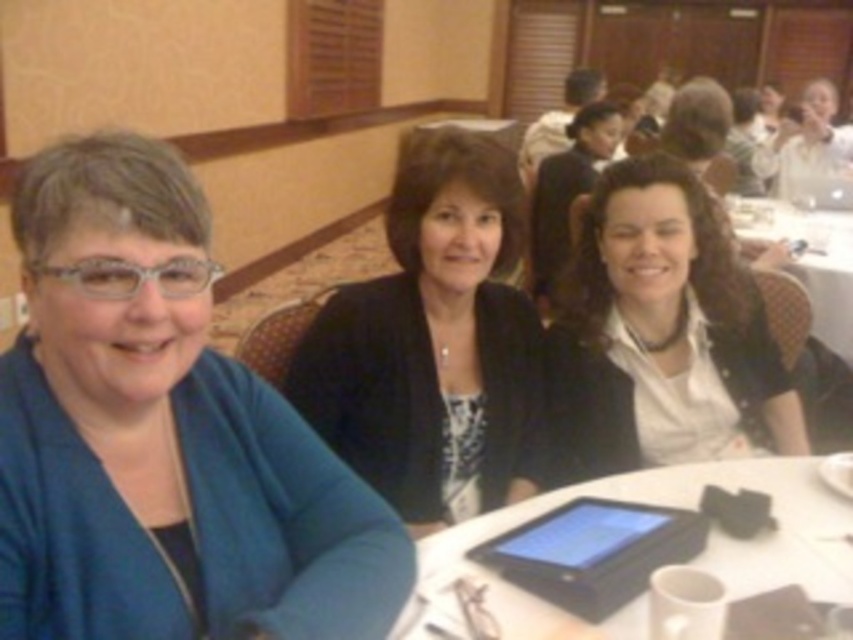
Is white matte shirt at center further to the viewer compared to white glossy table at lower center?

Yes, it is behind white glossy table at lower center.

Is point (593, 241) closer to viewer compared to point (440, 600)?

No, it is behind (440, 600).

What are the coordinates of `white matte shirt at center` in the screenshot? It's located at (654, 323).

Consider the image. Does black matte tablet at center lie in front of matte black jacket at center?

Yes, it is in front of matte black jacket at center.

Who is lower down, black matte tablet at center or matte black jacket at center?

black matte tablet at center is below.

Measure the distance between point (x=643, y=538) and camera.

A distance of 1.17 meters exists between point (x=643, y=538) and camera.

Locate an element on the screen. black matte tablet at center is located at coordinates (595, 544).

Looking at this image, does black matte blazer at center appear on the left side of white matte shirt at center?

Indeed, black matte blazer at center is positioned on the left side of white matte shirt at center.

Between point (466, 406) and point (601, 278), which one is positioned behind?

The point (601, 278) is more distant.

In order to click on black matte blazer at center in this screenshot , I will do `click(433, 344)`.

Identify the location of black matte blazer at center. Image resolution: width=853 pixels, height=640 pixels. (433, 344).